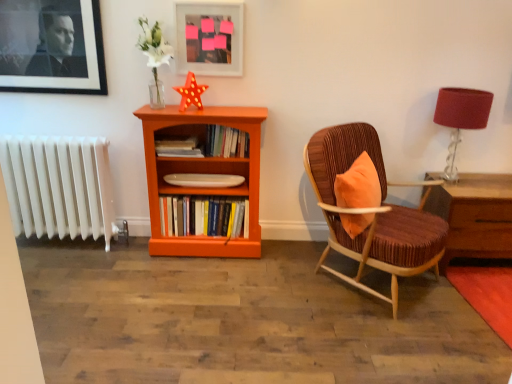
Where is `free location in front of white plastic radiator at left`? This screenshot has width=512, height=384. free location in front of white plastic radiator at left is located at coordinates (66, 283).